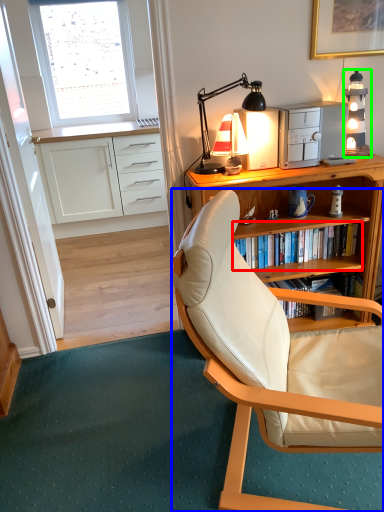
Question: Based on their relative distances, which object is nearer to shelf (highlighted by a red box)? Choose from chair (highlighted by a blue box) and lamp (highlighted by a green box).

Choices:
 (A) chair
 (B) lamp

Answer: (B)